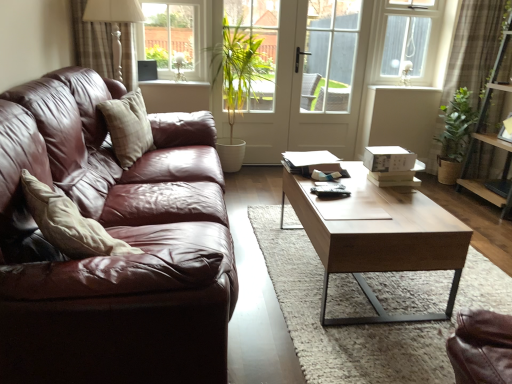
In order to face white glass screen door at center, should I rotate leftwards or rightwards?

Turn right approximately 9.730 degrees to face it.

What do you see at coordinates (404, 41) in the screenshot?
I see `clear glass window at upper right, which is the second window from left to right` at bounding box center [404, 41].

What do you see at coordinates (403, 88) in the screenshot? I see `white glossy window sill at upper center, the first window sill in the right-to-left sequence` at bounding box center [403, 88].

Identify the location of brown textured curtain at upper right, arranged as the 2th curtain when viewed from the left. (475, 48).

Is point (314, 113) closer or farther from the camera than point (173, 19)?

Point (314, 113) is farther from the camera than point (173, 19).

Based on their positions, is white glass screen door at center located to the left or right of clear glass window at upper left, marked as the second window in a right-to-left arrangement?

From the image, it's evident that white glass screen door at center is to the right of clear glass window at upper left, marked as the second window in a right-to-left arrangement.

From the picture: From the image's perspective, is white glass screen door at center under clear glass window at upper left, marked as the second window in a right-to-left arrangement?

Yes, from the image's perspective, white glass screen door at center is below clear glass window at upper left, marked as the second window in a right-to-left arrangement.

Is white glass screen door at center with clear glass window at upper left, marked as the second window in a right-to-left arrangement?

No, white glass screen door at center is not making contact with clear glass window at upper left, marked as the second window in a right-to-left arrangement.

From a real-world perspective, which object rests below the other?

In real-world perspective, white glass screen door at center is lower.

Is white glossy window sill at upper center, which ranks as the second window sill in right-to-left order, at the back of white glass screen door at center?

No, white glass screen door at center is not facing away from white glossy window sill at upper center, which ranks as the second window sill in right-to-left order.

Is white glass screen door at center to the right of white glossy window sill at upper center, which ranks as the second window sill in right-to-left order, from the viewer's perspective?

Correct, you'll find white glass screen door at center to the right of white glossy window sill at upper center, which ranks as the second window sill in right-to-left order.

Choose the correct answer: Is clear glass window at upper right, which is the second window from left to right, inside plaid fabric curtain at upper left, the second curtain positioned from the right, or outside it?

clear glass window at upper right, which is the second window from left to right, is outside plaid fabric curtain at upper left, the second curtain positioned from the right.

In terms of height, does clear glass window at upper right, which is the 1th window from right to left, look taller or shorter compared to plaid fabric curtain at upper left, placed as the first curtain when sorted from left to right?

Clearly, clear glass window at upper right, which is the 1th window from right to left, is taller compared to plaid fabric curtain at upper left, placed as the first curtain when sorted from left to right.

In terms of width, does clear glass window at upper right, which is the second window from left to right, look wider or thinner when compared to plaid fabric curtain at upper left, the second curtain positioned from the right?

Considering their sizes, clear glass window at upper right, which is the second window from left to right, looks slimmer than plaid fabric curtain at upper left, the second curtain positioned from the right.

Which is in front, point (416, 55) or point (73, 29)?

Point (73, 29)

From the leather couch at left, count 1st curtains backward and point to it. Please provide its 2D coordinates.

[(92, 42)]

Is plaid fabric curtain at upper left, placed as the first curtain when sorted from left to right, not near leather couch at left?

plaid fabric curtain at upper left, placed as the first curtain when sorted from left to right, is far away from leather couch at left.

Considering the positions of points (430, 2) and (182, 9), is point (430, 2) farther from camera compared to point (182, 9)?

Yes.

From the image's perspective, is clear glass window at upper right, which is the 1th window from right to left, on clear glass window at upper left, positioned as the first window in left-to-right order?

Yes, from the image's perspective, clear glass window at upper right, which is the 1th window from right to left, is over clear glass window at upper left, positioned as the first window in left-to-right order.

Considering the sizes of objects clear glass window at upper right, which is the 1th window from right to left, and clear glass window at upper left, positioned as the first window in left-to-right order, in the image provided, who is shorter, clear glass window at upper right, which is the 1th window from right to left, or clear glass window at upper left, positioned as the first window in left-to-right order,?

clear glass window at upper left, positioned as the first window in left-to-right order, is shorter.

From a real-world perspective, is clear glass window at upper right, which is the 1th window from right to left, positioned over clear glass window at upper left, marked as the second window in a right-to-left arrangement, based on gravity?

Yes.

Between wooden coffee table at center and plaid fabric curtain at upper left, placed as the first curtain when sorted from left to right, which one has less height?

Standing shorter between the two is wooden coffee table at center.

Is wooden coffee table at center oriented away from plaid fabric curtain at upper left, placed as the first curtain when sorted from left to right?

No.

Is wooden coffee table at center not near plaid fabric curtain at upper left, placed as the first curtain when sorted from left to right?

That's right, there is a large distance between wooden coffee table at center and plaid fabric curtain at upper left, placed as the first curtain when sorted from left to right.

Can you confirm if wooden coffee table at center is wider than plaid fabric curtain at upper left, placed as the first curtain when sorted from left to right?

Indeed, wooden coffee table at center has a greater width compared to plaid fabric curtain at upper left, placed as the first curtain when sorted from left to right.

Is leather couch at left surrounded by white glass screen door at center?

No, leather couch at left is not inside white glass screen door at center.

Where is `screen door on the right of leather couch at left`? This screenshot has height=384, width=512. screen door on the right of leather couch at left is located at coordinates click(x=329, y=75).

Can you confirm if white glass screen door at center is positioned to the right of leather couch at left?

Correct, you'll find white glass screen door at center to the right of leather couch at left.

From a real-world perspective, is white glass screen door at center positioned above or below leather couch at left?

Clearly, from a real-world perspective, white glass screen door at center is above leather couch at left.

Image resolution: width=512 pixels, height=384 pixels. I want to click on screen door behind the clear glass window at upper left, marked as the second window in a right-to-left arrangement, so click(329, 75).

The height and width of the screenshot is (384, 512). Identify the location of the 2nd window sill below when counting from the white glass screen door at center (from the image's perspective). (174, 83).

Based on the photo, estimate the real-world distances between objects in this image. Which object is closer to clear glass window at upper right, which is the 1th window from right to left, white glass screen door at center or plaid fabric curtain at upper left, placed as the first curtain when sorted from left to right?

white glass screen door at center is closer to clear glass window at upper right, which is the 1th window from right to left.

Which object lies nearer to the anchor point clear glass window at upper left, marked as the second window in a right-to-left arrangement, wooden coffee table at center or white glossy window sill at upper center, acting as the second window sill starting from the front?

Among the two, white glossy window sill at upper center, acting as the second window sill starting from the front, is located nearer to clear glass window at upper left, marked as the second window in a right-to-left arrangement.

Based on their spatial positions, is wooden coffee table at center or beige fabric pillow at left closer to clear glass window at upper left, marked as the second window in a right-to-left arrangement?

beige fabric pillow at left is positioned closer to the anchor clear glass window at upper left, marked as the second window in a right-to-left arrangement.

When comparing their distances from clear glass window at upper right, which is the second window from left to right, does wooden coffee table at center or brown textured curtain at upper right, which is counted as the first curtain, starting from the right, seem closer?

brown textured curtain at upper right, which is counted as the first curtain, starting from the right, is positioned closer to the anchor clear glass window at upper right, which is the second window from left to right.

Which object lies nearer to the anchor point clear glass window at upper right, which is the second window from left to right, brown textured curtain at upper right, arranged as the 2th curtain when viewed from the left, or beige fabric pillow at left?

Among the two, brown textured curtain at upper right, arranged as the 2th curtain when viewed from the left, is located nearer to clear glass window at upper right, which is the second window from left to right.

Considering their positions, is beige fabric pillow at left positioned further to white glass screen door at center than leather couch at left?

leather couch at left.

Estimate the real-world distances between objects in this image. Which object is closer to wooden coffee table at center, beige fabric pillow at left or plaid fabric curtain at upper left, placed as the first curtain when sorted from left to right?

beige fabric pillow at left is closer to wooden coffee table at center.

When comparing their distances from white glossy window sill at upper center, acting as the second window sill starting from the front, does beige fabric pillow at left or wooden coffee table at center seem further?

beige fabric pillow at left is positioned further to the anchor white glossy window sill at upper center, acting as the second window sill starting from the front.

You are a GUI agent. You are given a task and a screenshot of the screen. Output one action in this format:
    pyautogui.click(x=<x>, y=<y>)
    Task: Click on the coffee table between leather couch at left and white glossy window sill at upper center, which is counted as the 1th window sill, starting from the left, in the front-back direction
    This screenshot has height=384, width=512.
    Given the screenshot: What is the action you would take?
    pyautogui.click(x=380, y=240)

Identify the location of pillow positioned between leather couch at left and clear glass window at upper right, which is the 1th window from right to left, from near to far. (128, 127).

You are a GUI agent. You are given a task and a screenshot of the screen. Output one action in this format:
    pyautogui.click(x=<x>, y=<y>)
    Task: Click on the coffee table positioned between leather couch at left and clear glass window at upper right, which is the second window from left to right, from near to far
    The image size is (512, 384).
    Given the screenshot: What is the action you would take?
    pyautogui.click(x=380, y=240)

Image resolution: width=512 pixels, height=384 pixels. I want to click on studio couch between beige fabric pillow at left and wooden coffee table at center from left to right, so click(115, 237).